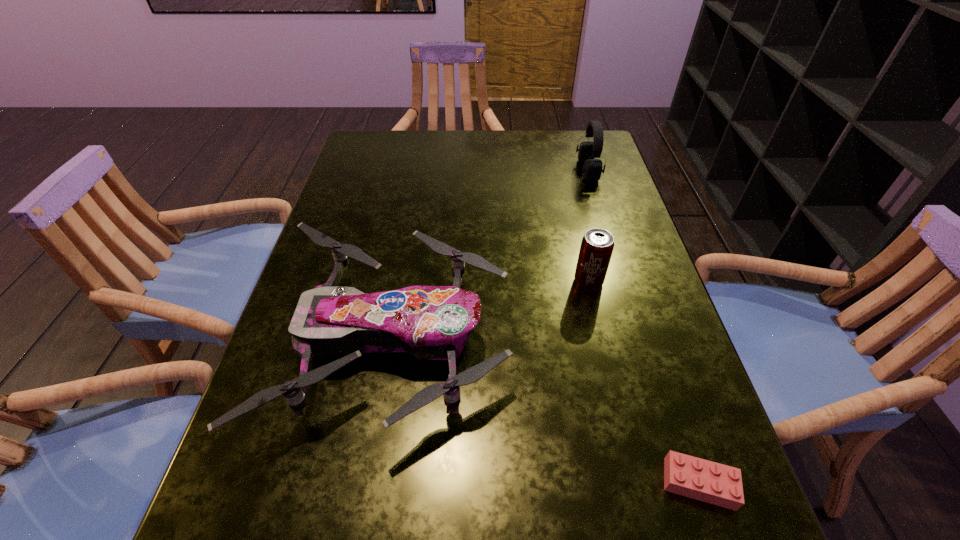
Image resolution: width=960 pixels, height=540 pixels. I want to click on vacant space located 0.290m on the back of the Lego, so click(643, 316).

Identify the location of object at the far edge. The width and height of the screenshot is (960, 540). (592, 168).

Locate an element on the screen. The height and width of the screenshot is (540, 960). object positioned at the left edge is located at coordinates (429, 322).

Find the location of a particular element. Image resolution: width=960 pixels, height=540 pixels. headset positioned at the right edge is located at coordinates (592, 168).

Find the location of a particular element. This screenshot has height=540, width=960. beer can that is at the right edge is located at coordinates (597, 245).

I want to click on Lego located at the right edge, so click(x=696, y=478).

At what (x,y) coordinates should I click in order to perform the action: click on object situated at the far right corner. Please return your answer as a coordinate pair (x, y). Image resolution: width=960 pixels, height=540 pixels. Looking at the image, I should click on (592, 168).

In the image, there is a desktop. Where is `vacant space at the far edge`? vacant space at the far edge is located at coordinates (527, 161).

This screenshot has height=540, width=960. I want to click on vacant space at the left edge, so click(x=340, y=229).

Identify the location of vacant region at the right edge of the desktop. (650, 399).